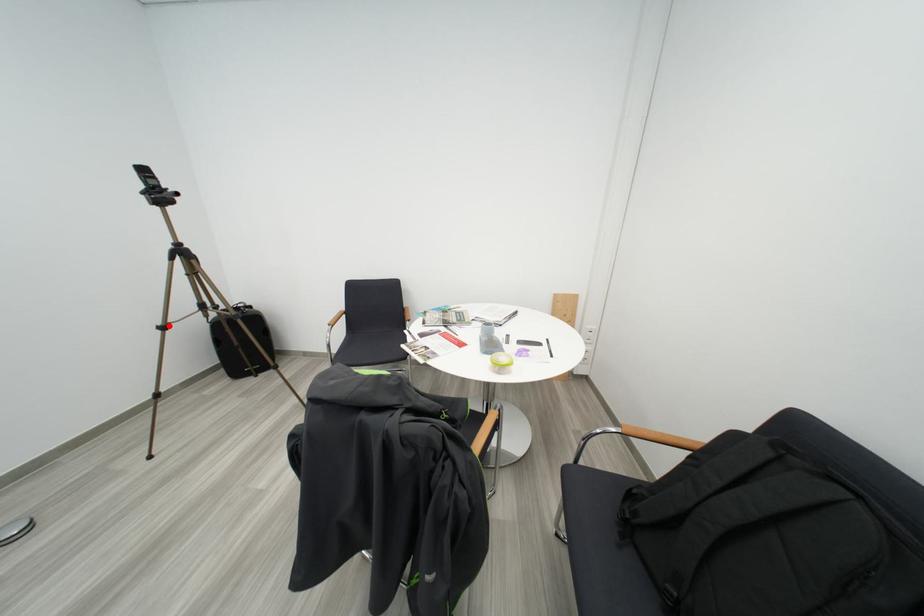
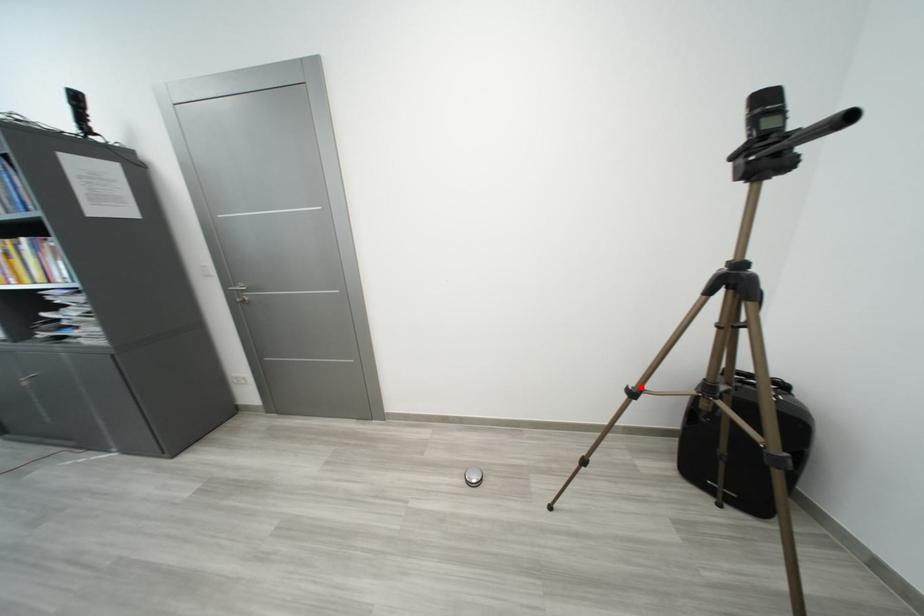
I am providing you with two images of the same scene from different viewpoints. A red point is marked on the first image and another point is marked on the second image. Is the marked point in image1 the same physical position as the marked point in image2?

Yes